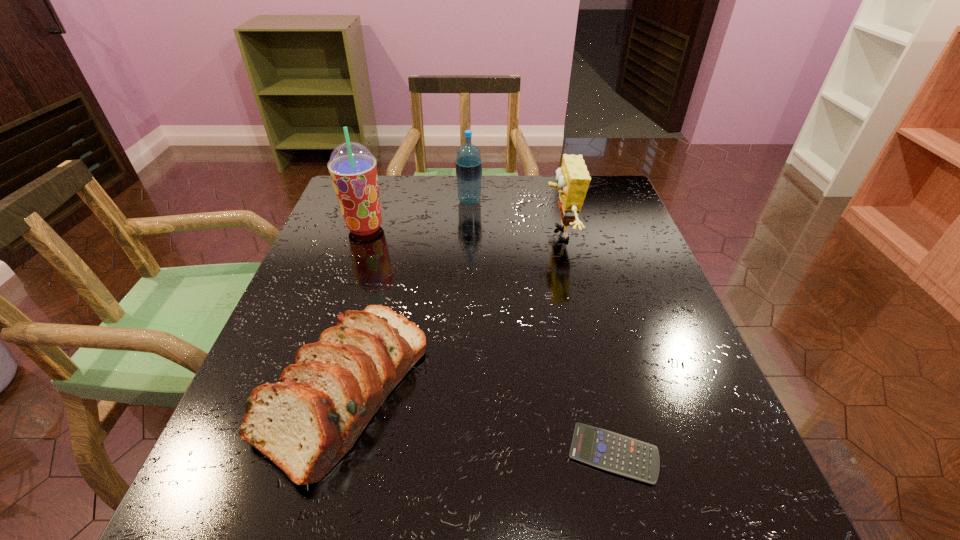
Locate which object ranks third in proximity to the bread. Please provide its 2D coordinates. Your answer should be formatted as a tuple, i.e. [(x, y)], where the tuple contains the x and y coordinates of a point satisfying the conditions above.

[(573, 179)]

This screenshot has width=960, height=540. Identify the location of object that can be found as the closest to the bread. (606, 450).

Find the location of a particular element. This screenshot has width=960, height=540. vacant region that satisfies the following two spatial constraints: 1. on the face of the shortest object; 2. on the left side of the sponge is located at coordinates (610, 454).

The width and height of the screenshot is (960, 540). In order to click on blank space that satisfies the following two spatial constraints: 1. on the front side of the smoothie; 2. on the right side of the second shortest object in this screenshot , I will do `click(310, 389)`.

At what (x,y) coordinates should I click in order to perform the action: click on free space that satisfies the following two spatial constraints: 1. on the front side of the calculator; 2. on the right side of the smoothie. Please return your answer as a coordinate pair (x, y). The width and height of the screenshot is (960, 540). Looking at the image, I should click on (288, 454).

Locate an element on the screen. This screenshot has height=540, width=960. vacant region that satisfies the following two spatial constraints: 1. on the front side of the water bottle; 2. on the right side of the shortest object is located at coordinates (461, 454).

Find the location of a particular element. This screenshot has height=540, width=960. vacant region that satisfies the following two spatial constraints: 1. on the front side of the shortest object; 2. on the right side of the water bottle is located at coordinates (461, 454).